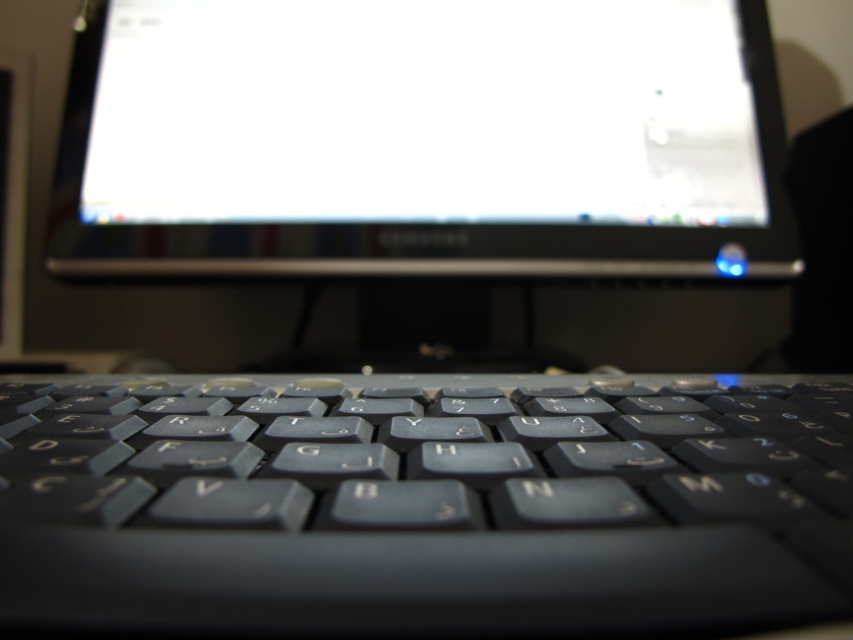
Does point (195, 394) lie in front of point (230, 44)?

That is True.

Does matte black keyboard at center lie in front of satin black monitor at center?

Yes, it is in front of satin black monitor at center.

At what (x,y) coordinates should I click in order to perform the action: click on matte black keyboard at center. Please return your answer as a coordinate pair (x, y). Looking at the image, I should click on (424, 502).